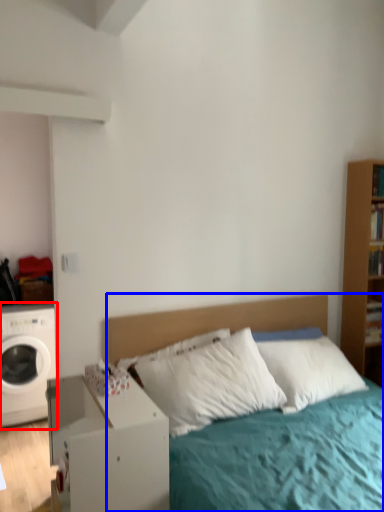
Question: Which of the following is the closest to the observer, washing machine (highlighted by a red box) or bed (highlighted by a blue box)?

Choices:
 (A) washing machine
 (B) bed

Answer: (B)